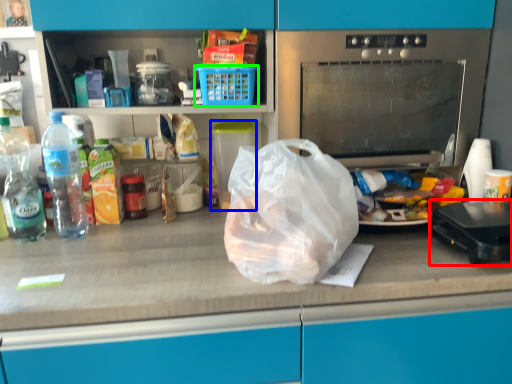
Question: Which object is the farthest from kitchen appliance (highlighted by a red box)? Choose among these: appliance (highlighted by a blue box) or basket (highlighted by a green box).

Choices:
 (A) appliance
 (B) basket

Answer: (A)